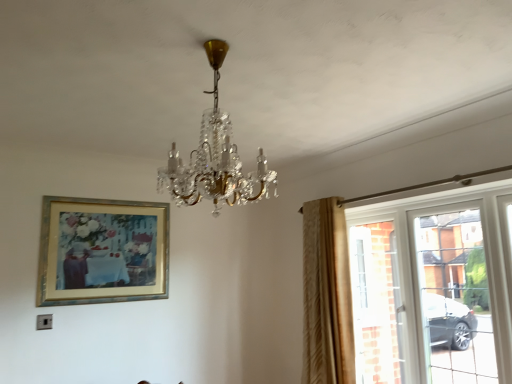
Question: Is gold metallic picture frame at upper left at the right side of beige textured curtain at right?

Choices:
 (A) no
 (B) yes

Answer: (A)

Question: Could you tell me if gold metallic picture frame at upper left is turned towards beige textured curtain at right?

Choices:
 (A) no
 (B) yes

Answer: (A)

Question: From the image's perspective, would you say gold metallic picture frame at upper left is shown under beige textured curtain at right?

Choices:
 (A) no
 (B) yes

Answer: (A)

Question: Is gold metallic picture frame at upper left at the left side of beige textured curtain at right?

Choices:
 (A) no
 (B) yes

Answer: (B)

Question: Is gold metallic picture frame at upper left bigger than beige textured curtain at right?

Choices:
 (A) yes
 (B) no

Answer: (B)

Question: In terms of size, does crystal glass chandelier at center appear bigger or smaller than clear glass window at right?

Choices:
 (A) small
 (B) big

Answer: (A)

Question: Considering their positions, is crystal glass chandelier at center located in front of or behind clear glass window at right?

Choices:
 (A) behind
 (B) front

Answer: (B)

Question: From their relative heights in the image, would you say crystal glass chandelier at center is taller or shorter than clear glass window at right?

Choices:
 (A) short
 (B) tall

Answer: (A)

Question: From a real-world perspective, relative to clear glass window at right, is crystal glass chandelier at center vertically above or below?

Choices:
 (A) above
 (B) below

Answer: (A)

Question: From their relative heights in the image, would you say clear glass window at right is taller or shorter than gold metallic picture frame at upper left?

Choices:
 (A) tall
 (B) short

Answer: (A)

Question: From a real-world perspective, is clear glass window at right positioned above or below gold metallic picture frame at upper left?

Choices:
 (A) above
 (B) below

Answer: (B)

Question: Is clear glass window at right situated inside gold metallic picture frame at upper left or outside?

Choices:
 (A) outside
 (B) inside

Answer: (A)

Question: Is point (484, 251) closer or farther from the camera than point (75, 259)?

Choices:
 (A) farther
 (B) closer

Answer: (B)

Question: In terms of height, does clear glass window at right look taller or shorter compared to crystal glass chandelier at center?

Choices:
 (A) tall
 (B) short

Answer: (A)

Question: In the image, is clear glass window at right on the left side or the right side of crystal glass chandelier at center?

Choices:
 (A) right
 (B) left

Answer: (A)